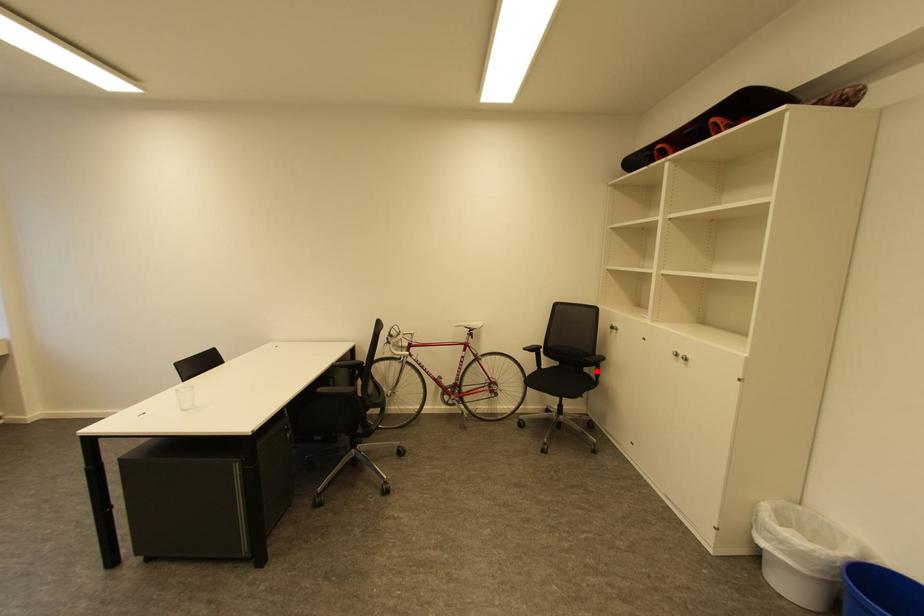
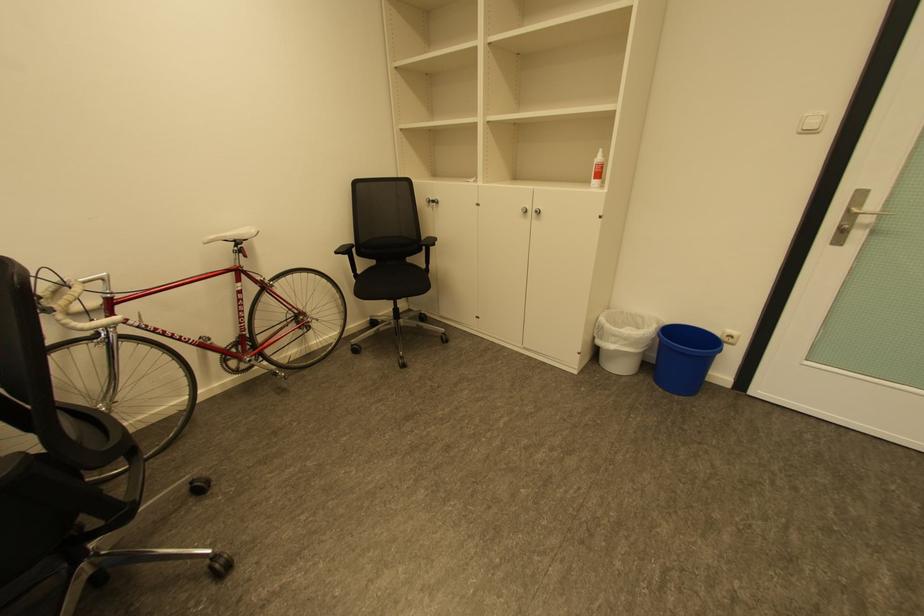
Question: I am providing you with two images of the same scene from different viewpoints. In image1, a red point is highlighted. Considering the same 3D point in image2, which of the following is correct?

Choices:
 (A) It is closer
 (B) It is farther

Answer: (A)